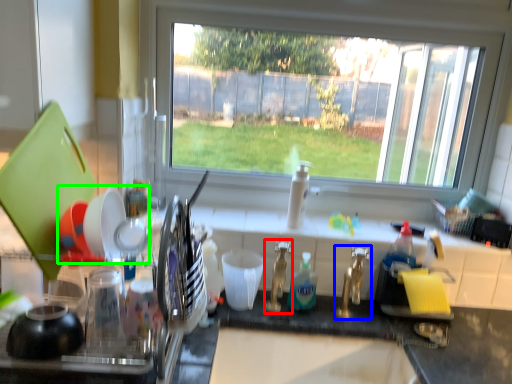
Question: Which object is positioned farthest from faucet (highlighted by a red box)? Select from tap (highlighted by a blue box) and tableware (highlighted by a green box).

Choices:
 (A) tap
 (B) tableware

Answer: (B)